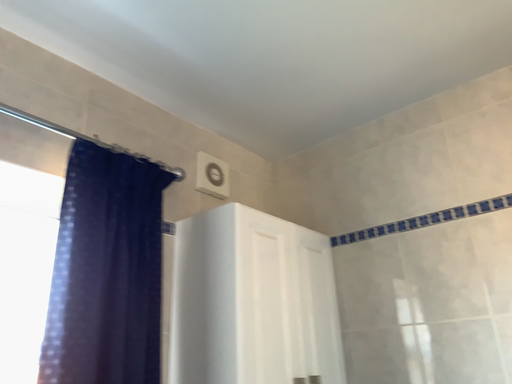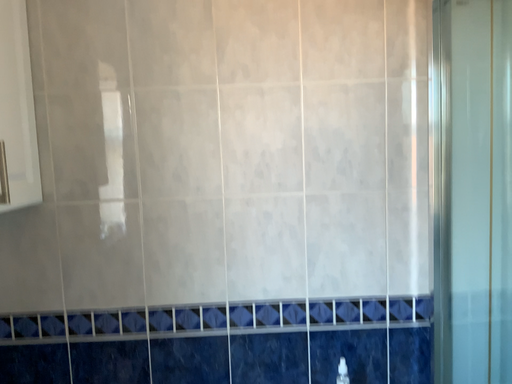
Question: How did the camera likely rotate when shooting the video?

Choices:
 (A) rotated upward
 (B) rotated downward

Answer: (B)